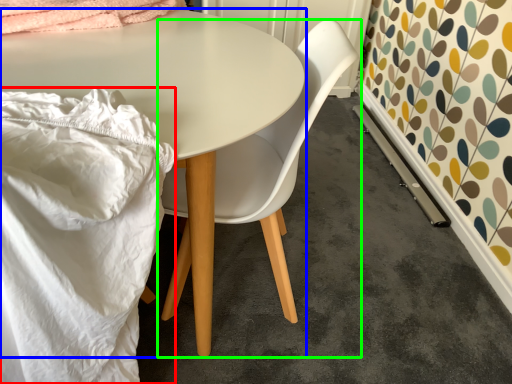
Question: Estimate the real-world distances between objects in this image. Which object is farther from blanket (highlighted by a red box), table (highlighted by a blue box) or chair (highlighted by a green box)?

Choices:
 (A) table
 (B) chair

Answer: (B)